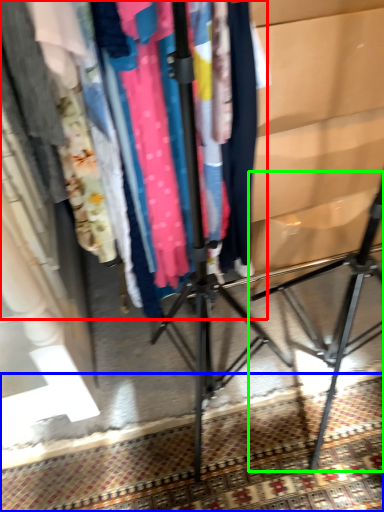
Question: Which is nearer to the closet (highlighted by a red box)? mat (highlighted by a blue box) or tripod (highlighted by a green box).

Choices:
 (A) mat
 (B) tripod

Answer: (A)